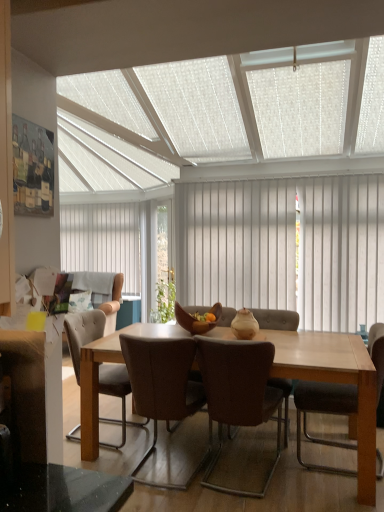
Question: Is white vertical blinds at center, the first curtain viewed from the right, at the left side of white textured ceiling at upper center?

Choices:
 (A) yes
 (B) no

Answer: (B)

Question: Could you tell me if white vertical blinds at center, marked as the first curtain in a front-to-back arrangement, is facing white textured ceiling at upper center?

Choices:
 (A) yes
 (B) no

Answer: (B)

Question: Is white vertical blinds at center, marked as the first curtain in a front-to-back arrangement, positioned with its back to white textured ceiling at upper center?

Choices:
 (A) no
 (B) yes

Answer: (A)

Question: From the image's perspective, does white vertical blinds at center, the second curtain positioned from the left, appear higher than white textured ceiling at upper center?

Choices:
 (A) no
 (B) yes

Answer: (A)

Question: Is white vertical blinds at center, placed as the second curtain when sorted from back to front, wider than white textured ceiling at upper center?

Choices:
 (A) yes
 (B) no

Answer: (B)

Question: Based on their positions, is white fabric pillow at left located to the left or right of wooden bowl at center?

Choices:
 (A) right
 (B) left

Answer: (B)

Question: In terms of height, does white fabric pillow at left look taller or shorter compared to wooden bowl at center?

Choices:
 (A) short
 (B) tall

Answer: (B)

Question: Is point (89, 308) positioned closer to the camera than point (190, 320)?

Choices:
 (A) farther
 (B) closer

Answer: (A)

Question: From the image's perspective, is white fabric pillow at left located above or below wooden bowl at center?

Choices:
 (A) below
 (B) above

Answer: (A)

Question: In the image, is wooden bowl at center positioned in front of or behind beige fabric couch at left?

Choices:
 (A) front
 (B) behind

Answer: (A)

Question: From a real-world perspective, relative to beige fabric couch at left, is wooden bowl at center vertically above or below?

Choices:
 (A) above
 (B) below

Answer: (A)

Question: Would you say wooden bowl at center is to the left or to the right of beige fabric couch at left in the picture?

Choices:
 (A) right
 (B) left

Answer: (A)

Question: Looking at their shapes, would you say wooden bowl at center is wider or thinner than beige fabric couch at left?

Choices:
 (A) wide
 (B) thin

Answer: (B)

Question: Based on their positions, is leather at center, the first chair from the left, located to the left or right of white textured ceiling at upper center?

Choices:
 (A) right
 (B) left

Answer: (A)

Question: From a real-world perspective, is leather at center, the first chair from the left, above or below white textured ceiling at upper center?

Choices:
 (A) below
 (B) above

Answer: (A)